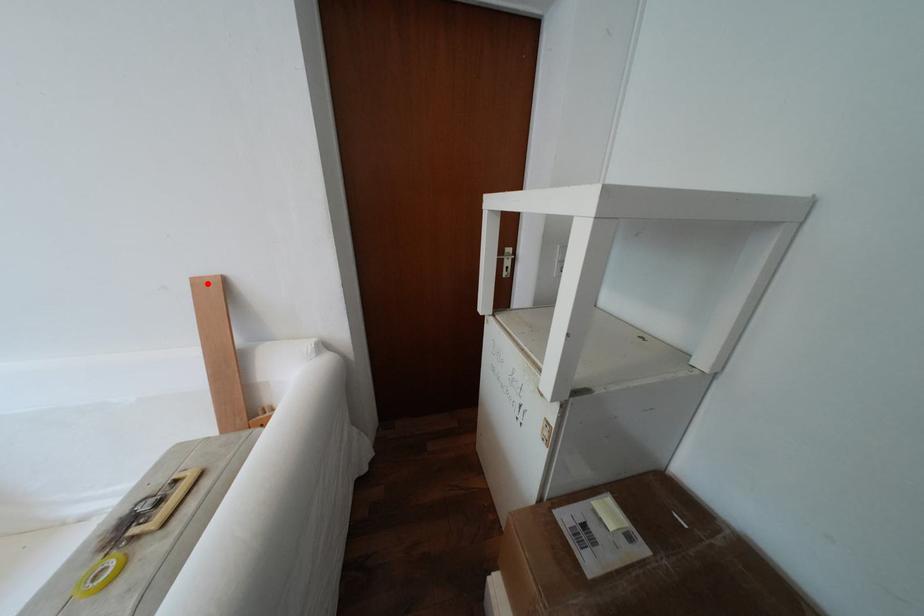
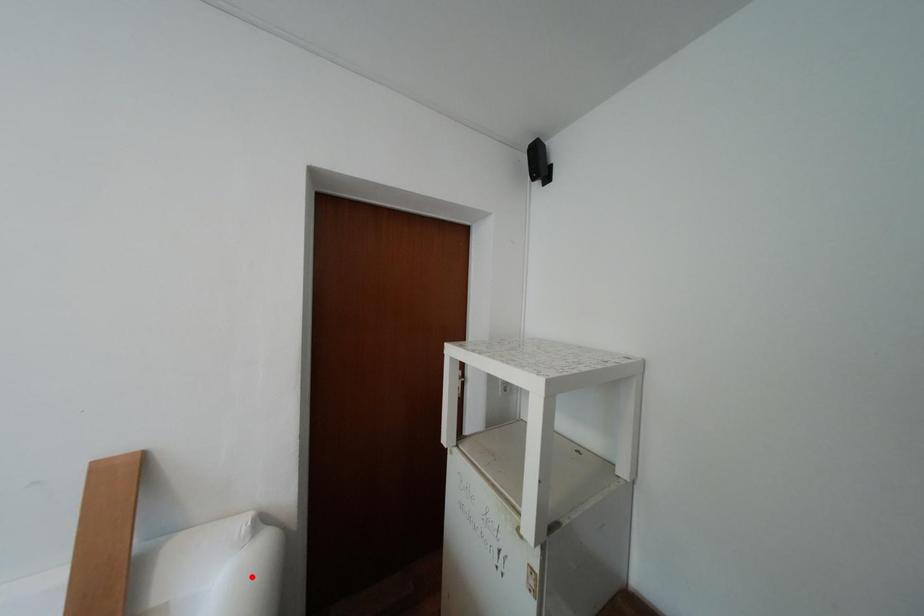
I am providing you with two images of the same scene from different viewpoints. A red point is marked on the first image and another point is marked on the second image. Do the highlighted points in image1 and image2 indicate the same real-world spot?

No